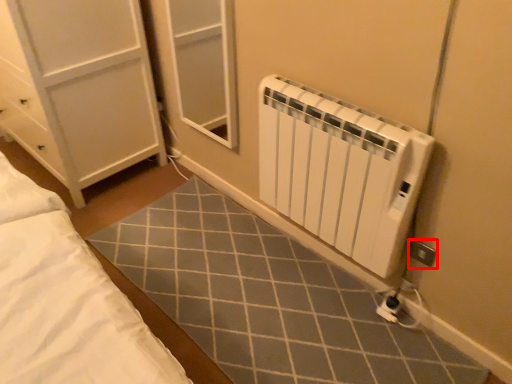
Question: From the image's perspective, where is electric outlet (annotated by the red box) located in relation to radiator in the image?

Choices:
 (A) below
 (B) above

Answer: (A)